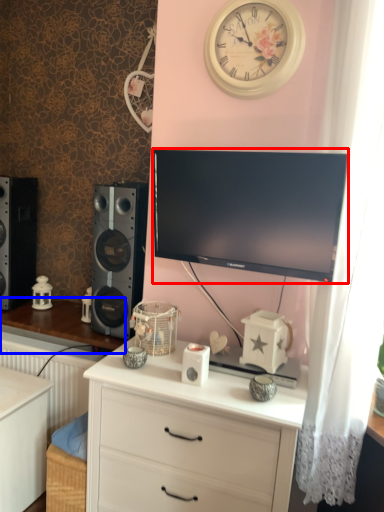
Question: Which object appears closest to the camera in this image, television (highlighted by a red box) or table (highlighted by a blue box)?

Choices:
 (A) television
 (B) table

Answer: (A)